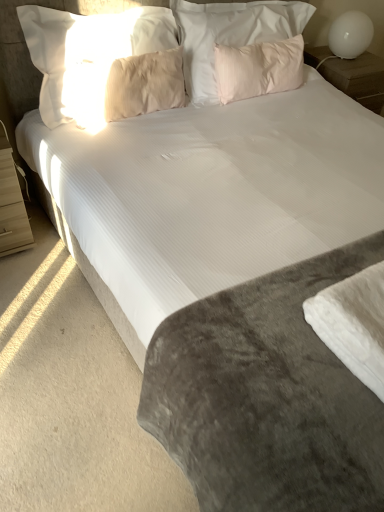
You are a GUI agent. You are given a task and a screenshot of the screen. Output one action in this format:
    pyautogui.click(x=<x>, y=<y>)
    Task: Click on the empty space that is ontop of white glossy table lamp at upper right (from a real-world perspective)
    The image size is (384, 512).
    Given the screenshot: What is the action you would take?
    pyautogui.click(x=357, y=9)